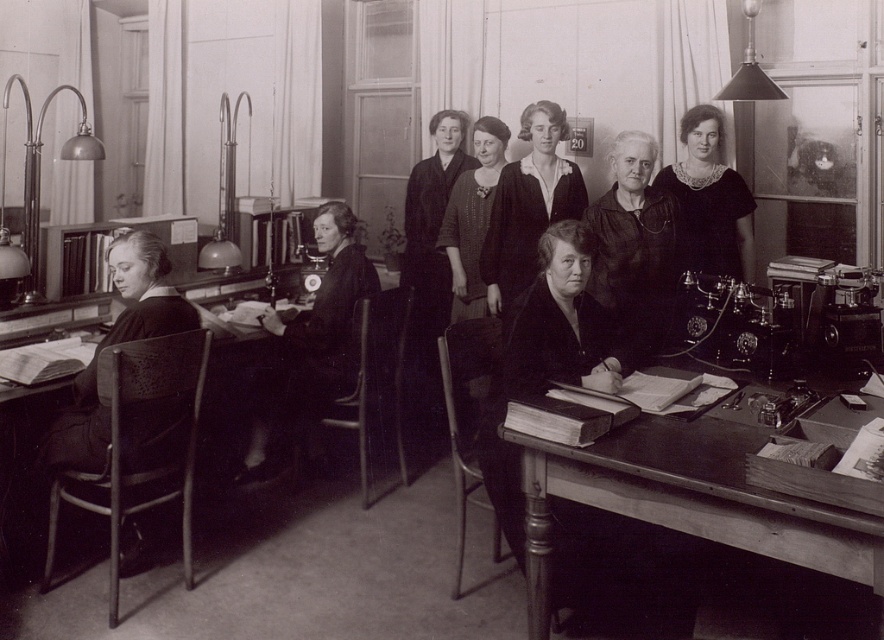
Who is more distant from viewer, (756, 492) or (601, 221)?

Point (601, 221)

Who is positioned more to the right, wooden desk at lower right or matte black coat at center?

matte black coat at center is more to the right.

Find the location of `wooden desk at lower right`. wooden desk at lower right is located at coordinates (687, 500).

I want to click on wooden desk at lower right, so click(687, 500).

Who is more forward, (x=315, y=376) or (x=745, y=216)?

Point (x=315, y=376) is more forward.

Which of these two, smooth black coat at center or black velvet dress at upper right, stands taller?

With more height is smooth black coat at center.

I want to click on smooth black coat at center, so click(x=313, y=333).

Find the location of a particular element. The height and width of the screenshot is (640, 884). smooth black coat at center is located at coordinates point(313,333).

Does matte black coat at center appear on the left side of smooth black coat at center?

No, matte black coat at center is not to the left of smooth black coat at center.

Who is lower down, matte black coat at center or smooth black coat at center?

smooth black coat at center is lower down.

I want to click on matte black coat at center, so click(634, 250).